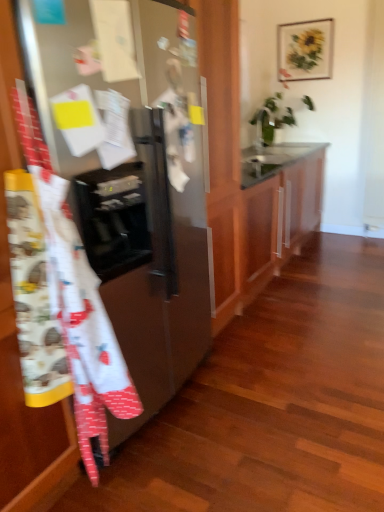
Where is `free spot to the right of satin silver refrigerator at left`? free spot to the right of satin silver refrigerator at left is located at coordinates (274, 394).